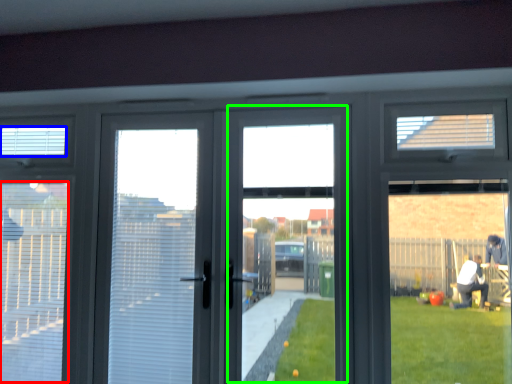
Question: Based on their relative distances, which object is farther from blind (highlighted by a red box)? Choose from blind (highlighted by a blue box) and window screen (highlighted by a green box).

Choices:
 (A) blind
 (B) window screen

Answer: (B)